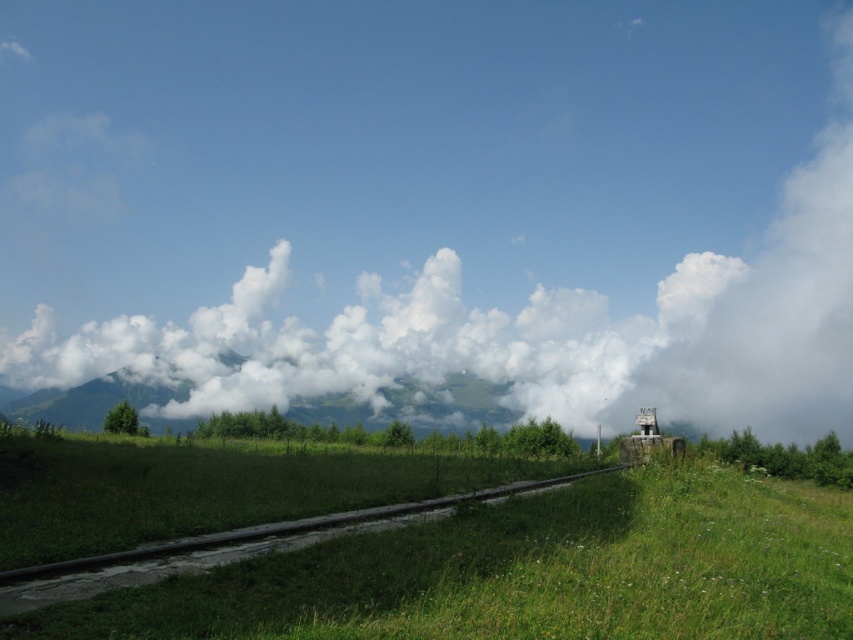
Who is positioned more to the left, white fluffy cloud at upper center or green grassy at center?

white fluffy cloud at upper center

Is white fluffy cloud at upper center further to camera compared to green grassy at center?

Yes.

Find the location of a particular element. The image size is (853, 640). white fluffy cloud at upper center is located at coordinates (436, 202).

You are a GUI agent. You are given a task and a screenshot of the screen. Output one action in this format:
    pyautogui.click(x=<x>, y=<y>)
    Task: Click on the white fluffy cloud at upper center
    The width and height of the screenshot is (853, 640).
    Given the screenshot: What is the action you would take?
    pyautogui.click(x=436, y=202)